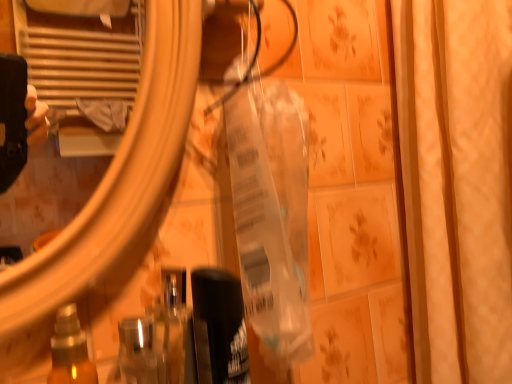
Image resolution: width=512 pixels, height=384 pixels. Describe the element at coordinates (457, 183) in the screenshot. I see `beige fabric shower curtain at right` at that location.

Where is `beige fabric shower curtain at right`? Image resolution: width=512 pixels, height=384 pixels. beige fabric shower curtain at right is located at coordinates (457, 183).

Locate an element on the screen. beige fabric shower curtain at right is located at coordinates (457, 183).